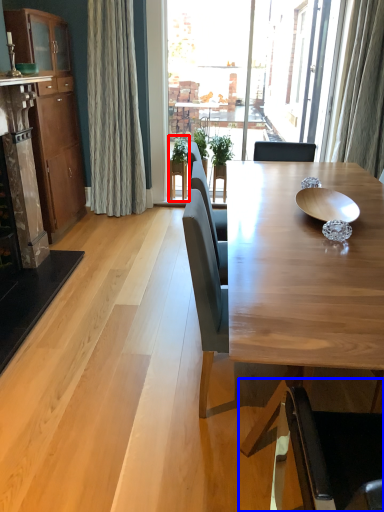
Question: Which of the following is the closest to the observer, houseplant (highlighted by a red box) or chair (highlighted by a blue box)?

Choices:
 (A) houseplant
 (B) chair

Answer: (B)